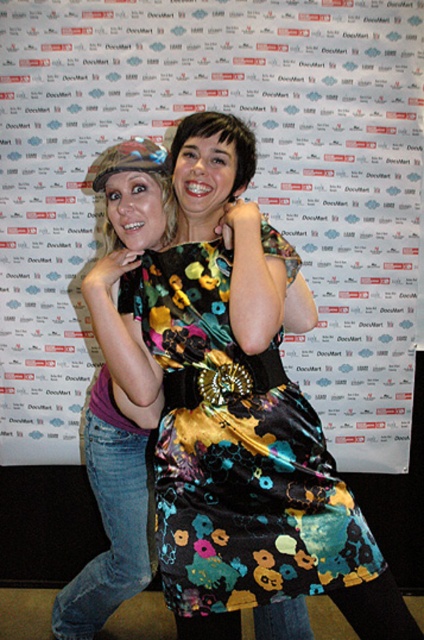
Question: Which object appears farthest from the camera in this image?

Choices:
 (A) denim jeans at left
 (B) multicolored floral dress at center
 (C) floral fabric dress at center
 (D) floral satin dress at center

Answer: (C)

Question: Is floral satin dress at center closer to the viewer compared to multicolored floral dress at center?

Choices:
 (A) yes
 (B) no

Answer: (A)

Question: Based on their relative distances, which object is farther from the multicolored floral dress at center?

Choices:
 (A) floral satin dress at center
 (B) floral fabric dress at center

Answer: (B)

Question: Is floral fabric dress at center to the right of denim jeans at left from the viewer's perspective?

Choices:
 (A) no
 (B) yes

Answer: (B)

Question: Does floral satin dress at center appear under denim jeans at left?

Choices:
 (A) no
 (B) yes

Answer: (A)

Question: Which object is the closest to the multicolored floral dress at center?

Choices:
 (A) denim jeans at left
 (B) floral satin dress at center
 (C) floral fabric dress at center

Answer: (B)